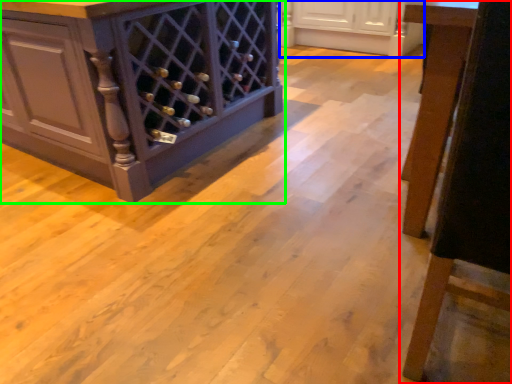
Question: Estimate the real-world distances between objects in this image. Which object is farther from furniture (highlighted by a red box), cabinetry (highlighted by a blue box) or cabinetry (highlighted by a green box)?

Choices:
 (A) cabinetry
 (B) cabinetry

Answer: (A)